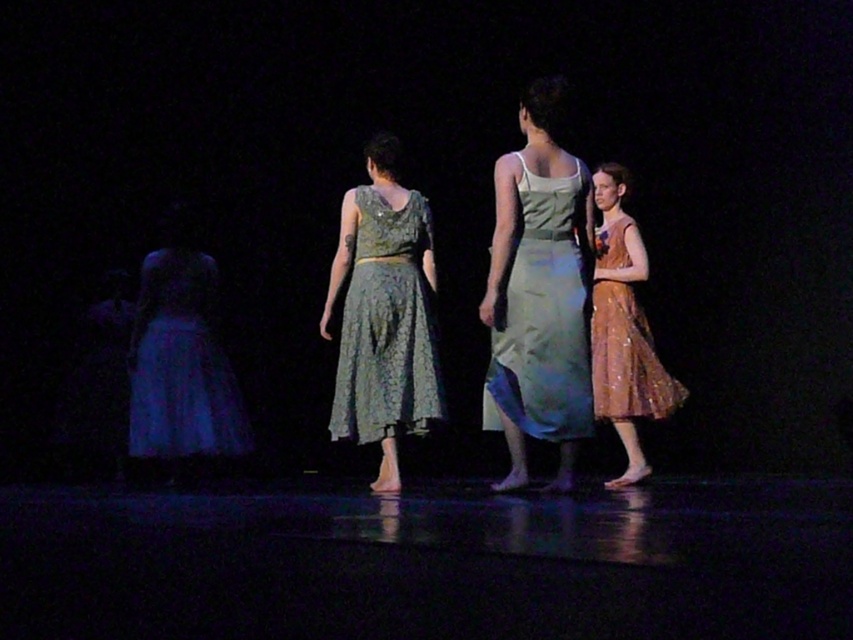
Question: Can you confirm if light green satin dress at center is thinner than lace fabric dress at center?

Choices:
 (A) no
 (B) yes

Answer: (B)

Question: Is matte blue dress at left to the right of shiny brown dress at right from the viewer's perspective?

Choices:
 (A) yes
 (B) no

Answer: (B)

Question: Which of the following is the farthest from the observer?

Choices:
 (A) click(x=614, y=349)
 (B) click(x=170, y=241)
 (C) click(x=360, y=426)

Answer: (B)

Question: Among these points, which one is farthest from the camera?

Choices:
 (A) (358, 246)
 (B) (543, 429)
 (C) (605, 314)
 (D) (177, 246)

Answer: (D)

Question: Estimate the real-world distances between objects in this image. Which object is closer to the light green satin dress at center?

Choices:
 (A) lace fabric dress at center
 (B) shiny brown dress at right
 (C) matte blue dress at left

Answer: (A)

Question: Does lace fabric dress at center come behind shiny brown dress at right?

Choices:
 (A) no
 (B) yes

Answer: (A)